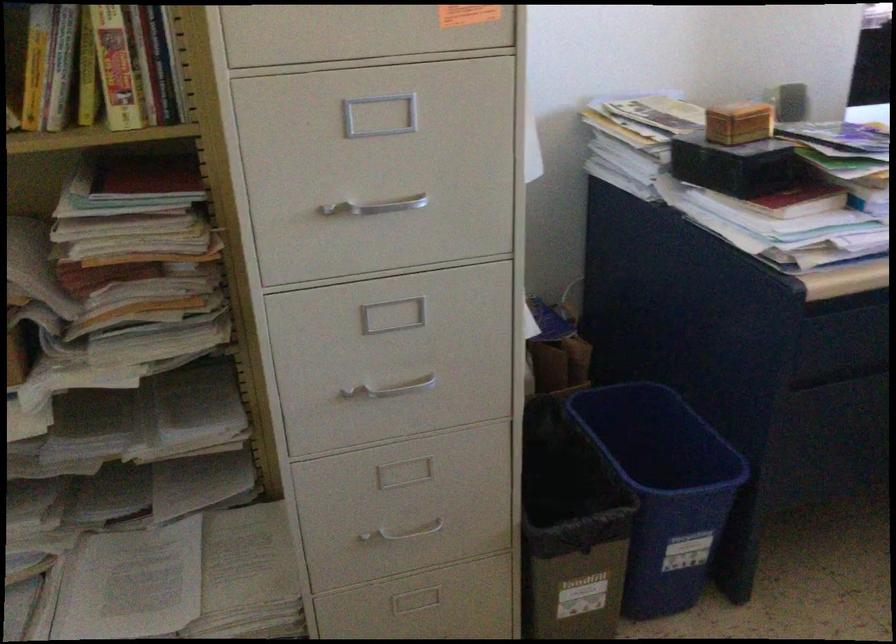
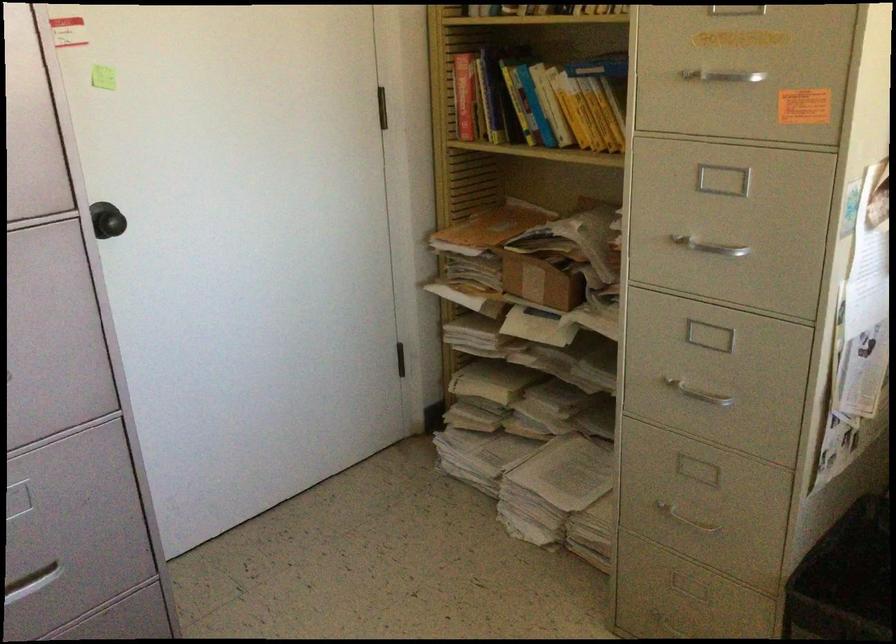
In the second image, find the point that corresponds to (x=402, y=382) in the first image.

(699, 391)